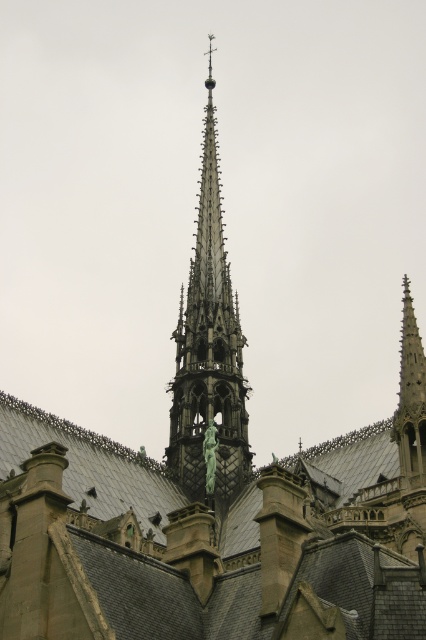
Consider the image. You are standing at the base of the cathedral and see the point marked at coordinates point (x=209, y=348). Based on the image description, which architectural feature is this point located on?

The point marked at coordinates point (x=209, y=348) is located on the dark gray stone spire at center.

You are an architect assessing the cathedral design. You need to determine which object occupies more space in the image between the dark gray stone spire at center and the green marble statue at upper center. Based on their sizes, which one would you say is bigger?

The dark gray stone spire at center has a larger size compared to the green marble statue at upper center, so the dark gray stone spire at center occupies more space in the image.